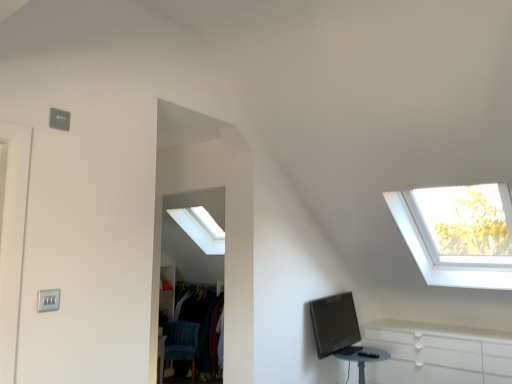
Question: Is black glossy computer monitor at lower right to the right of satin silver switch at lower left from the viewer's perspective?

Choices:
 (A) no
 (B) yes

Answer: (B)

Question: Considering the relative sizes of black glossy computer monitor at lower right and satin silver switch at lower left in the image provided, is black glossy computer monitor at lower right thinner than satin silver switch at lower left?

Choices:
 (A) no
 (B) yes

Answer: (A)

Question: From the image's perspective, does black glossy computer monitor at lower right appear lower than satin silver switch at lower left?

Choices:
 (A) no
 (B) yes

Answer: (B)

Question: From the image's perspective, is black glossy computer monitor at lower right over satin silver switch at lower left?

Choices:
 (A) yes
 (B) no

Answer: (B)

Question: Can you confirm if black glossy computer monitor at lower right is smaller than satin silver switch at lower left?

Choices:
 (A) yes
 (B) no

Answer: (B)

Question: Does black glossy computer monitor at lower right come behind satin silver switch at lower left?

Choices:
 (A) no
 (B) yes

Answer: (B)

Question: Is matte black table at lower right turned away from black glossy computer monitor at lower right?

Choices:
 (A) no
 (B) yes

Answer: (A)

Question: Is matte black table at lower right taller than black glossy computer monitor at lower right?

Choices:
 (A) no
 (B) yes

Answer: (A)

Question: Is matte black table at lower right thinner than black glossy computer monitor at lower right?

Choices:
 (A) yes
 (B) no

Answer: (B)

Question: From a real-world perspective, is matte black table at lower right located higher than black glossy computer monitor at lower right?

Choices:
 (A) yes
 (B) no

Answer: (B)

Question: Does matte black table at lower right lie behind black glossy computer monitor at lower right?

Choices:
 (A) no
 (B) yes

Answer: (A)

Question: From the image's perspective, does matte black table at lower right appear higher than black glossy computer monitor at lower right?

Choices:
 (A) yes
 (B) no

Answer: (B)

Question: From a real-world perspective, is velvet blue swivel chair at lower left over black glossy computer monitor at lower right?

Choices:
 (A) yes
 (B) no

Answer: (B)